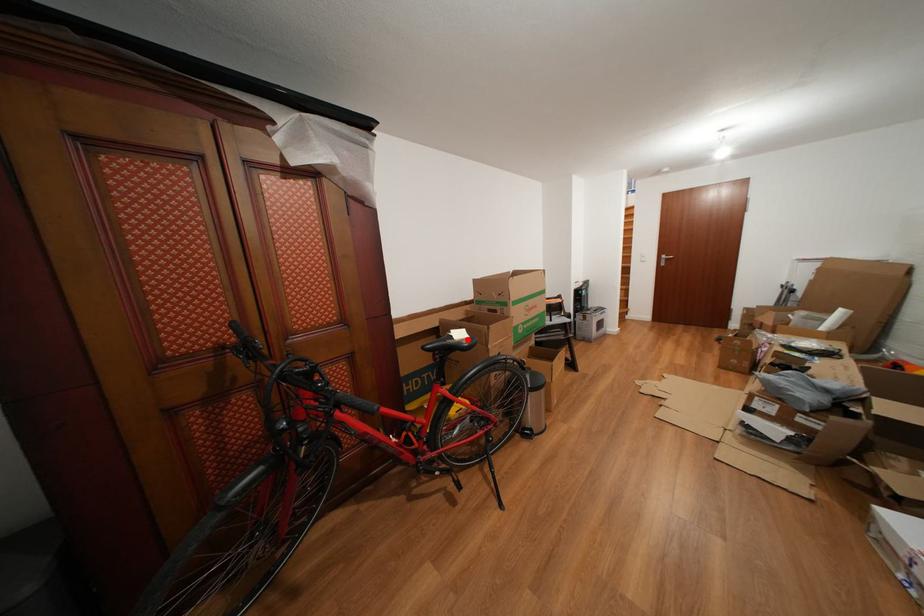
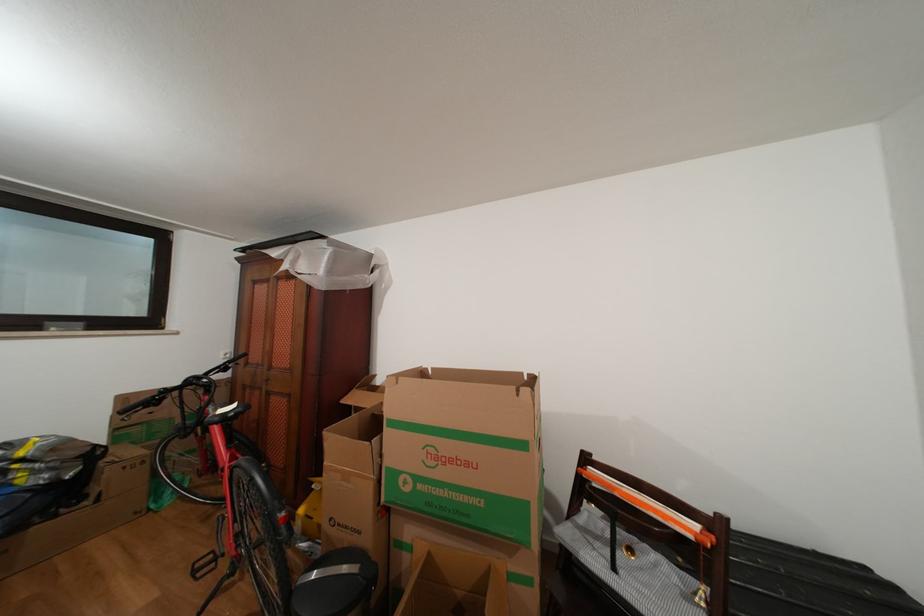
Question: I am providing you with two images of the same scene from different viewpoints. In image1, a red point is highlighted. Considering the same 3D point in image2, which of the following is correct?

Choices:
 (A) It is closer
 (B) It is farther

Answer: (A)